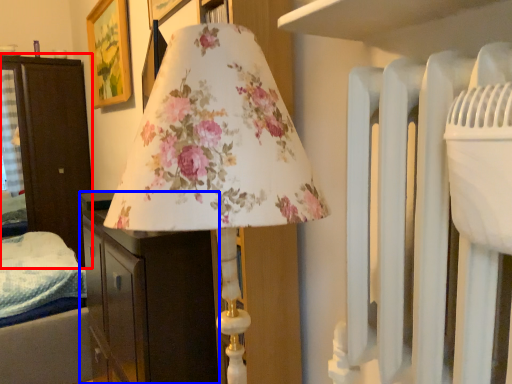
Question: Which object is closer to the camera taking this photo, furniture (highlighted by a red box) or furniture (highlighted by a blue box)?

Choices:
 (A) furniture
 (B) furniture

Answer: (B)